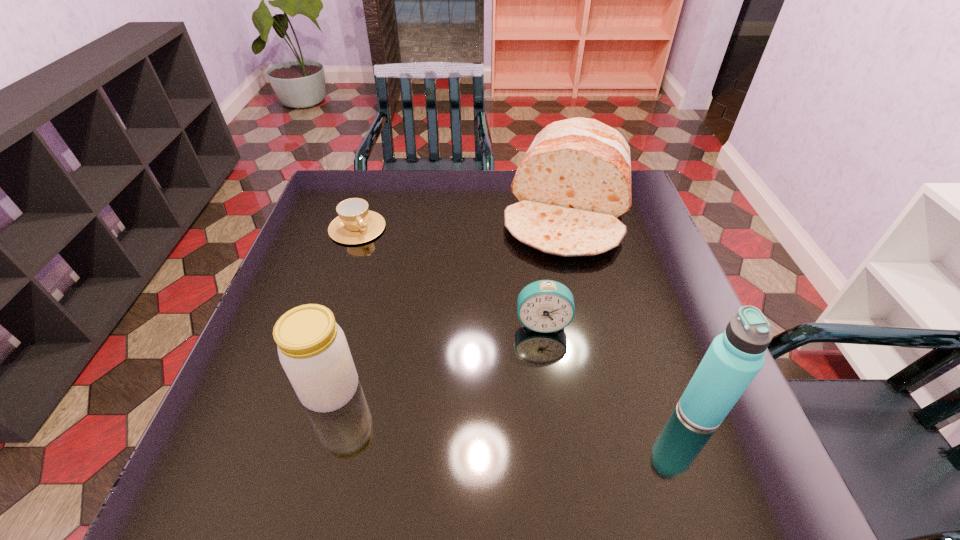
Identify the location of vacant space positioned on the front-facing side of the third nearest object. (544, 396).

The height and width of the screenshot is (540, 960). Identify the location of vacant region located 0.300m at the sliced end of the bread. (538, 353).

You are a GUI agent. You are given a task and a screenshot of the screen. Output one action in this format:
    pyautogui.click(x=<x>, y=<y>)
    Task: Click on the free space located 0.170m at the sliced end of the bread
    
    Given the screenshot: What is the action you would take?
    pyautogui.click(x=549, y=309)

The width and height of the screenshot is (960, 540). I want to click on vacant space located 0.250m at the sliced end of the bread, so click(x=542, y=335).

Locate an element on the screen. vacant area located with the handle on the side of the shortest object is located at coordinates (381, 262).

Locate an element on the screen. The height and width of the screenshot is (540, 960). vacant space located with the handle on the side of the shortest object is located at coordinates (398, 288).

Identify the location of vacant point located 0.240m with the handle on the side of the shortest object. (405, 298).

Where is `bread located at the far edge`? bread located at the far edge is located at coordinates (574, 182).

Identify the location of cup that is at the far edge. The height and width of the screenshot is (540, 960). (355, 224).

The width and height of the screenshot is (960, 540). I want to click on jar present at the near edge, so click(x=313, y=351).